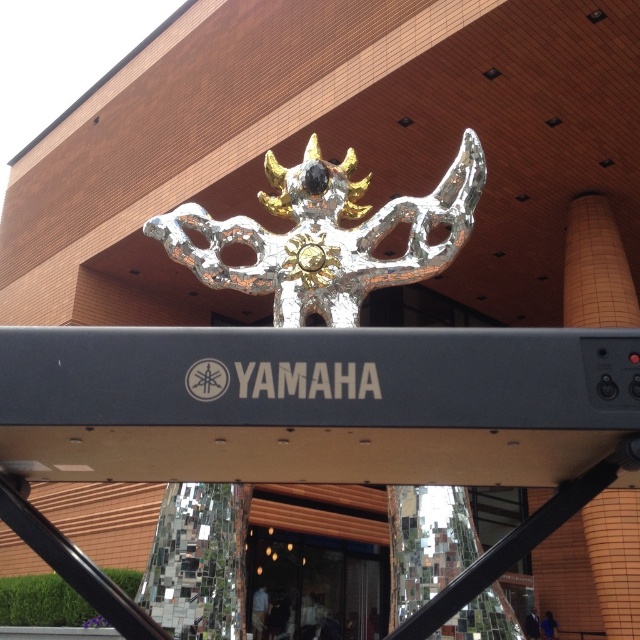
Can you confirm if shiny silver sculpture at center is positioned below transparent glass door at lower center?

Incorrect, shiny silver sculpture at center is not positioned below transparent glass door at lower center.

Can you confirm if shiny silver sculpture at center is taller than transparent glass door at lower center?

In fact, shiny silver sculpture at center may be shorter than transparent glass door at lower center.

The height and width of the screenshot is (640, 640). In order to click on shiny silver sculpture at center in this screenshot , I will do `click(326, 236)`.

The image size is (640, 640). I want to click on shiny silver sculpture at center, so click(326, 236).

Describe the element at coordinates (326, 236) in the screenshot. I see `shiny silver sculpture at center` at that location.

Measure the distance from shiny silver sculpture at center to orange textured pillar at upper center.

They are 19.86 meters apart.

I want to click on shiny silver sculpture at center, so click(326, 236).

Where is `transparent glass door at lower center`? Image resolution: width=640 pixels, height=640 pixels. transparent glass door at lower center is located at coordinates (316, 586).

Between transparent glass door at lower center and orange textured pillar at upper center, which one is positioned lower?

transparent glass door at lower center

Between point (352, 602) and point (602, 250), which one is positioned behind?

The point (352, 602) is more distant.

The height and width of the screenshot is (640, 640). In order to click on transparent glass door at lower center in this screenshot , I will do `click(316, 586)`.